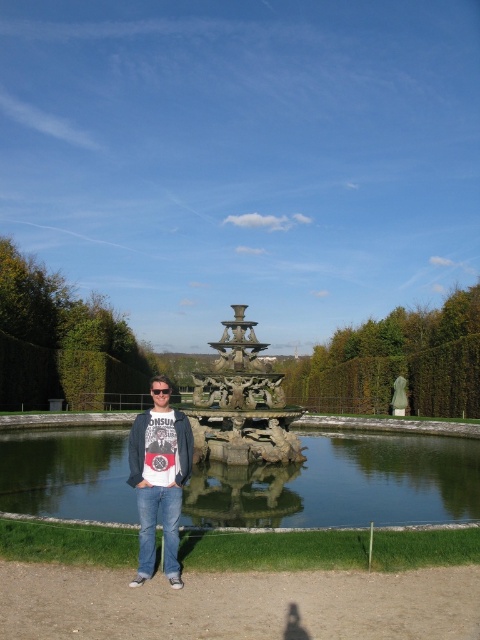
You are a photographer trying to capture the bronze sculpture at center and the denim jacket at center in a single shot. Which object should you focus on first to ensure both are in frame?

You should focus on the bronze sculpture at center first because it is closer to you than the denim jacket at center, ensuring both are in frame.